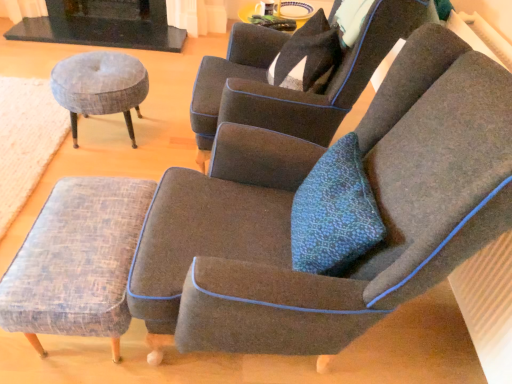
Describe the element at coordinates (77, 261) in the screenshot. I see `textured gray stool at lower left, the first stool positioned from the bottom` at that location.

What is the approximate width of dark gray fabric chair at center, the 2th chair positioned from the back?

96.83 centimeters.

What do you see at coordinates (26, 140) in the screenshot?
I see `woven fabric ottoman at lower left` at bounding box center [26, 140].

Measure the distance between textured gray fabric stool at left, the 2th stool viewed from the front, and camera.

textured gray fabric stool at left, the 2th stool viewed from the front, is 1.99 meters away from camera.

Locate an element on the screen. The image size is (512, 384). black stone fireplace at upper left is located at coordinates (102, 25).

Identify the location of dark gray fabric chair at upper center, arranged as the 2th chair when viewed from the front. (291, 90).

Find the location of a particular element. The width and height of the screenshot is (512, 384). textured gray stool at lower left, which is the second stool in back-to-front order is located at coordinates [x=77, y=261].

From the image's perspective, is woven fabric ottoman at lower left beneath textured gray fabric stool at left, the second stool positioned from the bottom?

Yes.

From a real-world perspective, which is physically below, woven fabric ottoman at lower left or textured gray fabric stool at left, arranged as the first stool when viewed from the back?

woven fabric ottoman at lower left is physically lower.

Which object is closer to the camera taking this photo, woven fabric ottoman at lower left or textured gray fabric stool at left, the second stool positioned from the bottom?

Positioned in front is woven fabric ottoman at lower left.

What's the angular difference between woven fabric ottoman at lower left and textured gray fabric stool at left, the second stool positioned from the bottom,'s facing directions?

The angular difference between woven fabric ottoman at lower left and textured gray fabric stool at left, the second stool positioned from the bottom, is 89.1 degrees.

Looking at this image, is textured gray stool at lower left, the first stool positioned from the bottom, not within dark gray fabric chair at center, acting as the first chair starting from the front?

Yes, textured gray stool at lower left, the first stool positioned from the bottom, is not within dark gray fabric chair at center, acting as the first chair starting from the front.

Does point (106, 315) come closer to viewer compared to point (212, 247)?

Yes, point (106, 315) is in front of point (212, 247).

Which object is further away from the camera taking this photo, textured gray stool at lower left, which is the second stool in back-to-front order, or dark gray fabric chair at center, acting as the first chair starting from the front?

textured gray stool at lower left, which is the second stool in back-to-front order, is further away from the camera.

Between point (104, 318) and point (27, 105), which one is positioned behind?

The point (27, 105) is behind.

How distant is textured gray stool at lower left, which is counted as the first stool, starting from the front, from woven fabric ottoman at lower left?

textured gray stool at lower left, which is counted as the first stool, starting from the front, and woven fabric ottoman at lower left are 31.08 inches apart.

From the image's perspective, relative to woven fabric ottoman at lower left, is textured gray stool at lower left, which is counted as the first stool, starting from the front, above or below?

From the image's perspective, textured gray stool at lower left, which is counted as the first stool, starting from the front, appears below woven fabric ottoman at lower left.

Which object is further away from the camera, textured gray stool at lower left, the first stool positioned from the bottom, or woven fabric ottoman at lower left?

woven fabric ottoman at lower left is behind.

From a real-world perspective, is woven fabric ottoman at lower left under black stone fireplace at upper left?

Indeed, from a real-world perspective, woven fabric ottoman at lower left is positioned beneath black stone fireplace at upper left.

Considering the relative positions of woven fabric ottoman at lower left and black stone fireplace at upper left in the image provided, is woven fabric ottoman at lower left to the right of black stone fireplace at upper left from the viewer's perspective?

No, woven fabric ottoman at lower left is not to the right of black stone fireplace at upper left.

Is woven fabric ottoman at lower left thinner than black stone fireplace at upper left?

No, woven fabric ottoman at lower left is not thinner than black stone fireplace at upper left.

Looking at this image, would you consider woven fabric ottoman at lower left to be distant from black stone fireplace at upper left?

Yes.

Considering the relative sizes of textured gray stool at lower left, which is the second stool in back-to-front order, and black stone fireplace at upper left in the image provided, is textured gray stool at lower left, which is the second stool in back-to-front order, taller than black stone fireplace at upper left?

Yes, textured gray stool at lower left, which is the second stool in back-to-front order, is taller than black stone fireplace at upper left.

Is textured gray stool at lower left, marked as the second stool in a top-to-bottom arrangement, oriented towards black stone fireplace at upper left?

No, textured gray stool at lower left, marked as the second stool in a top-to-bottom arrangement, is not aimed at black stone fireplace at upper left.

Which object is further away from the camera taking this photo, textured gray stool at lower left, the first stool positioned from the bottom, or black stone fireplace at upper left?

black stone fireplace at upper left is more distant.

Is black stone fireplace at upper left a part of textured gray stool at lower left, which is the second stool in back-to-front order?

Definitely not — black stone fireplace at upper left is not inside textured gray stool at lower left, which is the second stool in back-to-front order.

Which is in front, point (274, 161) or point (150, 20)?

The point (274, 161) is closer.

Considering the relative sizes of dark gray fabric chair at center, the 2th chair positioned from the back, and black stone fireplace at upper left in the image provided, is dark gray fabric chair at center, the 2th chair positioned from the back, taller than black stone fireplace at upper left?

Yes, dark gray fabric chair at center, the 2th chair positioned from the back, is taller than black stone fireplace at upper left.

Considering the positions of objects dark gray fabric chair at center, acting as the first chair starting from the front, and black stone fireplace at upper left in the image provided, who is more to the right, dark gray fabric chair at center, acting as the first chair starting from the front, or black stone fireplace at upper left?

Positioned to the right is dark gray fabric chair at center, acting as the first chair starting from the front.

Is dark gray fabric chair at center, acting as the first chair starting from the front, looking in the opposite direction of black stone fireplace at upper left?

No, black stone fireplace at upper left is not at the back of dark gray fabric chair at center, acting as the first chair starting from the front.

How many degrees apart are the facing directions of textured gray fabric stool at left, the 2th stool viewed from the front, and dark gray fabric chair at upper center, the 1th chair in the back-to-front sequence?

The facing directions of textured gray fabric stool at left, the 2th stool viewed from the front, and dark gray fabric chair at upper center, the 1th chair in the back-to-front sequence, are 0.00178 degrees apart.

Between textured gray fabric stool at left, arranged as the first stool when viewed from the back, and dark gray fabric chair at upper center, arranged as the 2th chair when viewed from the front, which one has smaller width?

textured gray fabric stool at left, arranged as the first stool when viewed from the back, is thinner.

Could dark gray fabric chair at upper center, the 1th chair in the back-to-front sequence, be considered to be inside textured gray fabric stool at left, the second stool positioned from the bottom?

No, dark gray fabric chair at upper center, the 1th chair in the back-to-front sequence, is not surrounded by textured gray fabric stool at left, the second stool positioned from the bottom.

Is textured gray fabric stool at left, the second stool positioned from the bottom, next to dark gray fabric chair at upper center, arranged as the 2th chair when viewed from the front, and touching it?

No, textured gray fabric stool at left, the second stool positioned from the bottom, is not making contact with dark gray fabric chair at upper center, arranged as the 2th chair when viewed from the front.

Identify the location of the 1st stool counting from the right of the woven fabric ottoman at lower left. (100, 86).

At what (x,y) coordinates should I click in order to perform the action: click on stool below the dark gray fabric chair at center, the 2th chair positioned from the back (from the image's perspective). Please return your answer as a coordinate pair (x, y). Image resolution: width=512 pixels, height=384 pixels. Looking at the image, I should click on pyautogui.click(x=77, y=261).

Which object lies further to the anchor point textured gray fabric stool at left, arranged as the first stool when viewed from the back, dark gray fabric chair at upper center, the 1th chair in the back-to-front sequence, or dark gray fabric chair at center, acting as the first chair starting from the front?

Among the two, dark gray fabric chair at center, acting as the first chair starting from the front, is located further to textured gray fabric stool at left, arranged as the first stool when viewed from the back.

Considering their positions, is textured gray stool at lower left, which is counted as the first stool, starting from the front, positioned closer to black stone fireplace at upper left than woven fabric ottoman at lower left?

woven fabric ottoman at lower left lies closer to black stone fireplace at upper left than the other object.

Considering their positions, is textured gray fabric stool at left, the second stool positioned from the bottom, positioned closer to textured gray stool at lower left, marked as the second stool in a top-to-bottom arrangement, than black stone fireplace at upper left?

Among the two, textured gray fabric stool at left, the second stool positioned from the bottom, is located nearer to textured gray stool at lower left, marked as the second stool in a top-to-bottom arrangement.

From the image, which object appears to be nearer to dark gray fabric chair at center, acting as the first chair starting from the front, dark gray fabric chair at upper center, arranged as the 2th chair when viewed from the front, or textured gray stool at lower left, marked as the second stool in a top-to-bottom arrangement?

textured gray stool at lower left, marked as the second stool in a top-to-bottom arrangement, is closer to dark gray fabric chair at center, acting as the first chair starting from the front.

From the image, which object appears to be farther from dark gray fabric chair at upper center, the 1th chair in the back-to-front sequence, textured gray stool at lower left, which is counted as the first stool, starting from the front, or woven fabric ottoman at lower left?

The object further to dark gray fabric chair at upper center, the 1th chair in the back-to-front sequence, is woven fabric ottoman at lower left.

Which object lies further to the anchor point textured gray stool at lower left, marked as the second stool in a top-to-bottom arrangement, dark gray fabric chair at center, acting as the first chair starting from the front, or black stone fireplace at upper left?

black stone fireplace at upper left.

From the image, which object appears to be nearer to dark gray fabric chair at center, the 2th chair positioned from the back, textured gray stool at lower left, marked as the second stool in a top-to-bottom arrangement, or black stone fireplace at upper left?

textured gray stool at lower left, marked as the second stool in a top-to-bottom arrangement, lies closer to dark gray fabric chair at center, the 2th chair positioned from the back, than the other object.

From the image, which object appears to be farther from textured gray fabric stool at left, placed as the first stool when sorted from top to bottom, black stone fireplace at upper left or dark gray fabric chair at upper center, the 1th chair in the back-to-front sequence?

Among the two, black stone fireplace at upper left is located further to textured gray fabric stool at left, placed as the first stool when sorted from top to bottom.

Locate an element on the screen. chair between dark gray fabric chair at center, the 2th chair positioned from the back, and black stone fireplace at upper left, along the z-axis is located at coordinates (291, 90).

At what (x,y) coordinates should I click in order to perform the action: click on mat between textured gray stool at lower left, the first stool positioned from the bottom, and textured gray fabric stool at left, the second stool positioned from the bottom, from front to back. Please return your answer as a coordinate pair (x, y). This screenshot has width=512, height=384. Looking at the image, I should click on (26, 140).

Locate an element on the screen. The image size is (512, 384). stool located between woven fabric ottoman at lower left and black stone fireplace at upper left in the depth direction is located at coordinates (100, 86).

In order to click on stool between dark gray fabric chair at upper center, the 1th chair in the back-to-front sequence, and black stone fireplace at upper left, along the z-axis in this screenshot , I will do `click(100, 86)`.